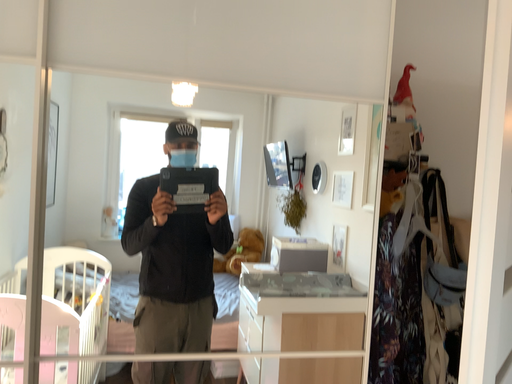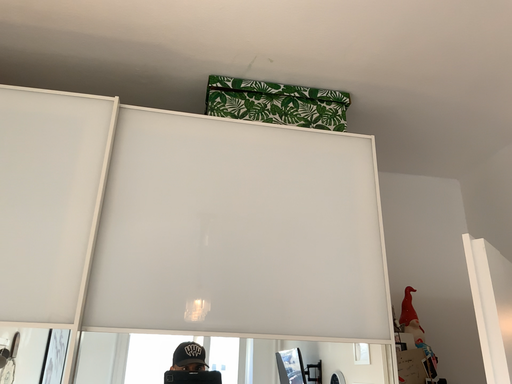
Question: How did the camera likely rotate when shooting the video?

Choices:
 (A) rotated downward
 (B) rotated upward

Answer: (B)